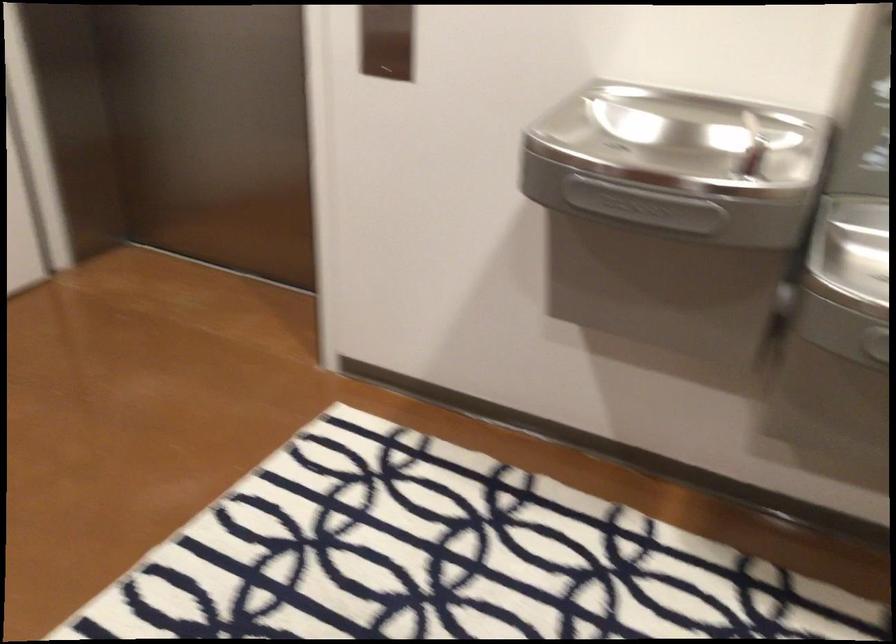
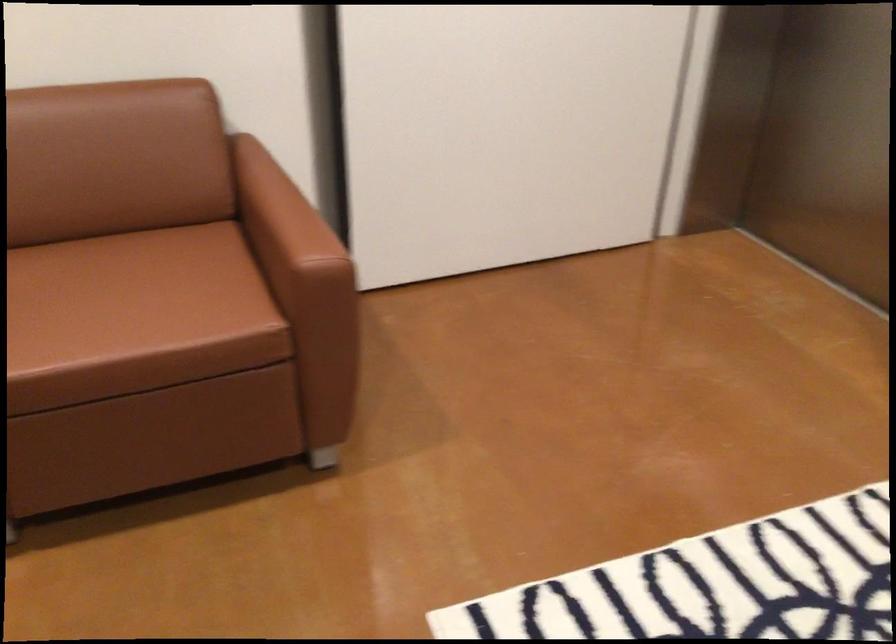
Question: Based on the continuous images, in which direction is the camera rotating? Reply with the corresponding letter.

Choices:
 (A) Left
 (B) Right
 (C) Up
 (D) Down

Answer: (A)